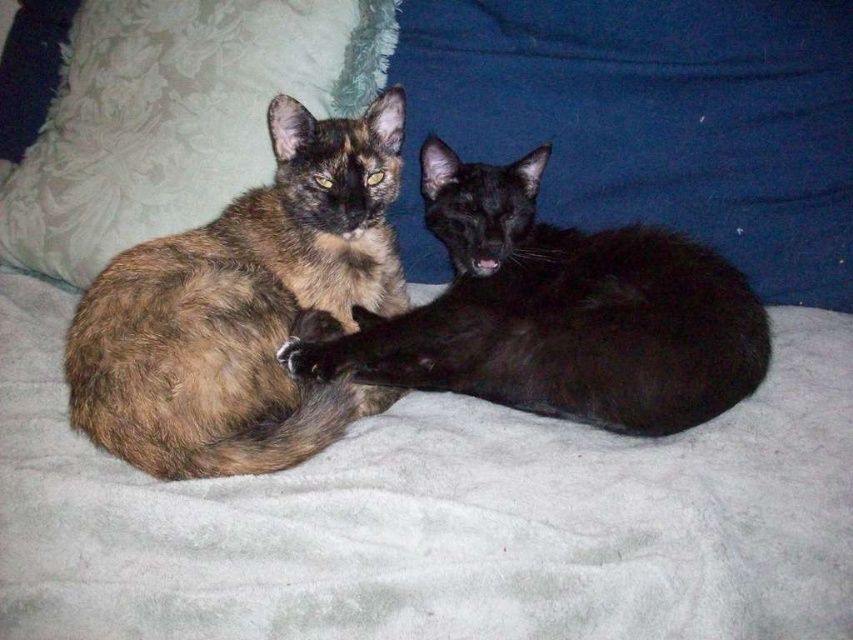
Question: Which point is closer to the camera?

Choices:
 (A) brown tortoiseshell cat at center
 (B) white fluffy pillow at upper left
 (C) blue fabric pillow at upper center

Answer: (A)

Question: Among these objects, which one is farthest from the camera?

Choices:
 (A) blue fabric pillow at upper center
 (B) tortoiseshell fur cat at left
 (C) white fluffy pillow at upper left
 (D) brown tortoiseshell cat at center

Answer: (C)

Question: Observing the image, what is the correct spatial positioning of blue fabric pillow at upper center in reference to tortoiseshell fur cat at left?

Choices:
 (A) right
 (B) left

Answer: (A)

Question: Does blue fabric pillow at upper center appear on the left side of brown tortoiseshell cat at center?

Choices:
 (A) yes
 (B) no

Answer: (B)

Question: Which point is closer to the camera?

Choices:
 (A) (579, 337)
 (B) (817, 280)
 (C) (131, 326)
 (D) (296, 92)

Answer: (C)

Question: Does tortoiseshell fur cat at left appear under white fluffy pillow at upper left?

Choices:
 (A) yes
 (B) no

Answer: (A)